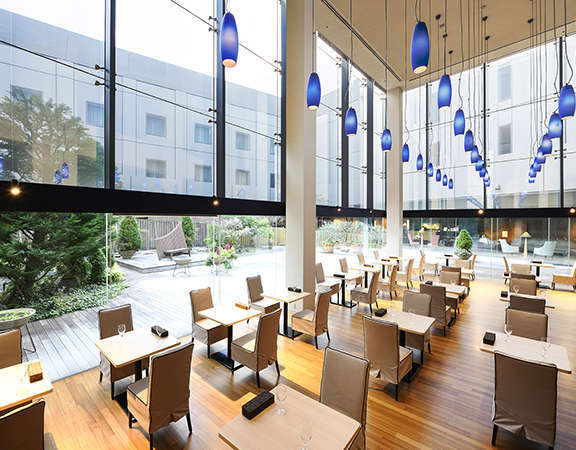
Locate an element on the screen. The height and width of the screenshot is (450, 576). glassware is located at coordinates (118, 333), (276, 393), (409, 318), (393, 310), (507, 326), (548, 340), (516, 289), (450, 283), (306, 433).